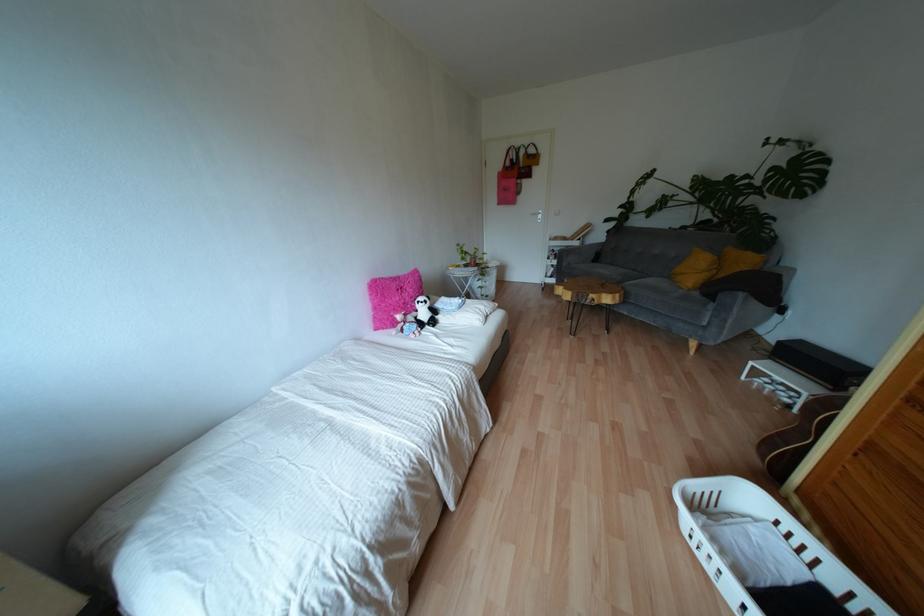
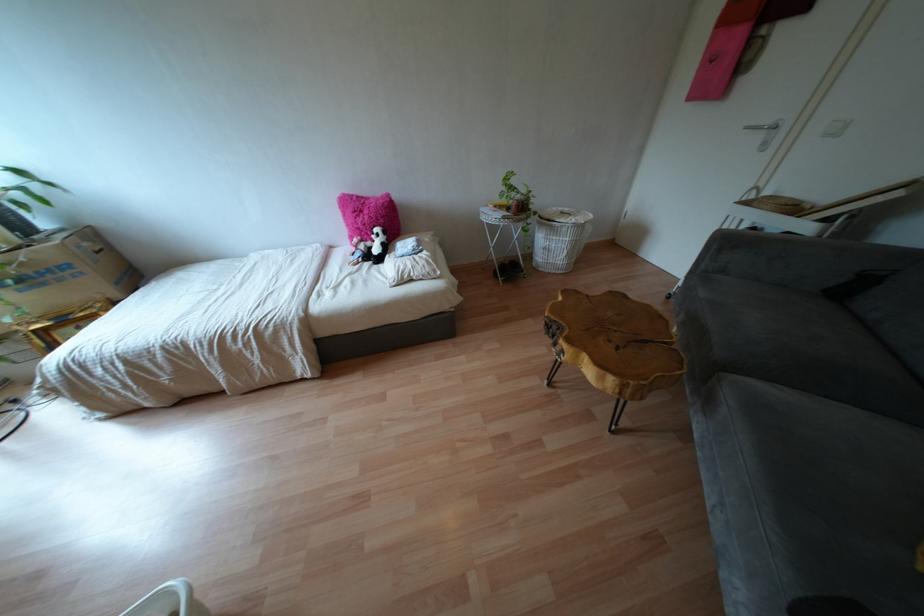
In the second image, find the point that corresponds to pixel 410 290 in the first image.

(365, 217)